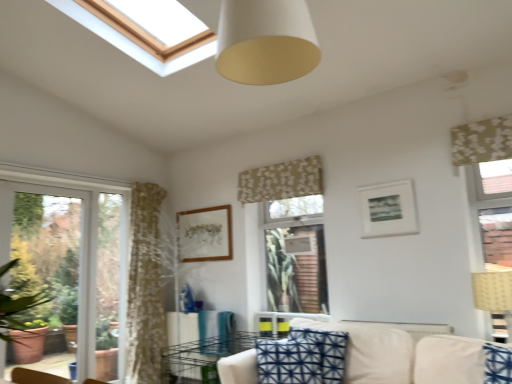
Question: Considering the relative sizes of white glass window at left and white matte cone at upper center in the image provided, is white glass window at left thinner than white matte cone at upper center?

Choices:
 (A) yes
 (B) no

Answer: (A)

Question: Is white glass window at left not within white matte cone at upper center?

Choices:
 (A) no
 (B) yes

Answer: (B)

Question: Does white glass window at left have a greater height compared to white matte cone at upper center?

Choices:
 (A) no
 (B) yes

Answer: (B)

Question: Does white glass window at left turn towards white matte cone at upper center?

Choices:
 (A) yes
 (B) no

Answer: (A)

Question: Considering the relative sizes of white glass window at left and white matte cone at upper center in the image provided, is white glass window at left smaller than white matte cone at upper center?

Choices:
 (A) no
 (B) yes

Answer: (B)

Question: In the image, is wooden picture frame at center, the first picture frame positioned from the left, on the left side or the right side of beige fabric couch at lower center?

Choices:
 (A) right
 (B) left

Answer: (B)

Question: Would you say wooden picture frame at center, placed as the 2th picture frame when sorted from front to back, is inside or outside beige fabric couch at lower center?

Choices:
 (A) outside
 (B) inside

Answer: (A)

Question: From a real-world perspective, relative to beige fabric couch at lower center, is wooden picture frame at center, the first picture frame positioned from the left, vertically above or below?

Choices:
 (A) above
 (B) below

Answer: (A)

Question: Considering the positions of wooden picture frame at center, placed as the 2th picture frame when sorted from front to back, and beige fabric couch at lower center in the image, is wooden picture frame at center, placed as the 2th picture frame when sorted from front to back, wider or thinner than beige fabric couch at lower center?

Choices:
 (A) wide
 (B) thin

Answer: (B)

Question: From the image's perspective, is metallic wire rack at lower center positioned above or below blue printed cushion at center?

Choices:
 (A) above
 (B) below

Answer: (B)

Question: In terms of width, does metallic wire rack at lower center look wider or thinner when compared to blue printed cushion at center?

Choices:
 (A) thin
 (B) wide

Answer: (B)

Question: From a real-world perspective, is metallic wire rack at lower center positioned above or below blue printed cushion at center?

Choices:
 (A) below
 (B) above

Answer: (A)

Question: Is metallic wire rack at lower center taller or shorter than blue printed cushion at center?

Choices:
 (A) short
 (B) tall

Answer: (A)

Question: Is beige woven lampshade at right situated inside floral fabric curtain at center, which is the first curtain from left to right, or outside?

Choices:
 (A) outside
 (B) inside

Answer: (A)

Question: Would you say beige woven lampshade at right is to the left or to the right of floral fabric curtain at center, the 2th curtain when ordered from front to back, in the picture?

Choices:
 (A) right
 (B) left

Answer: (A)